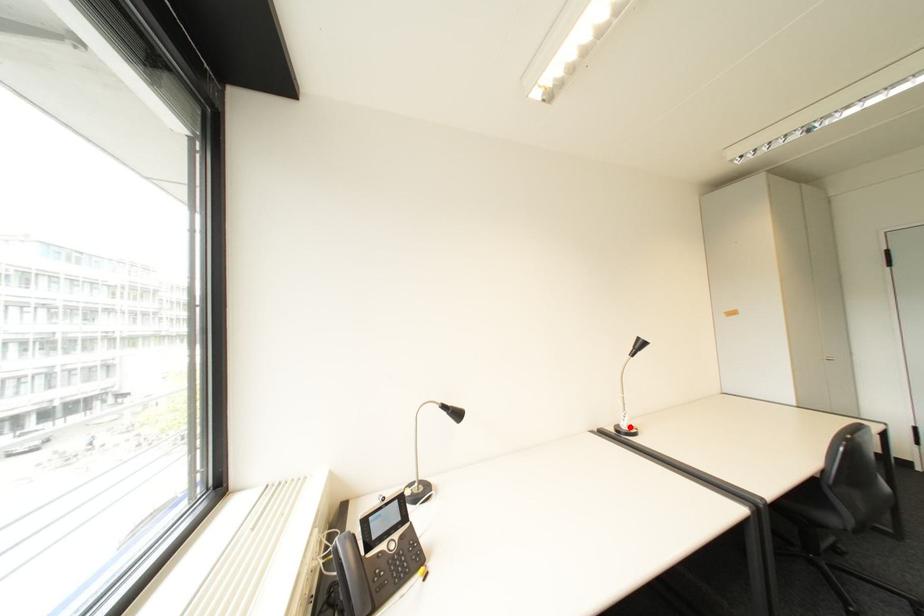
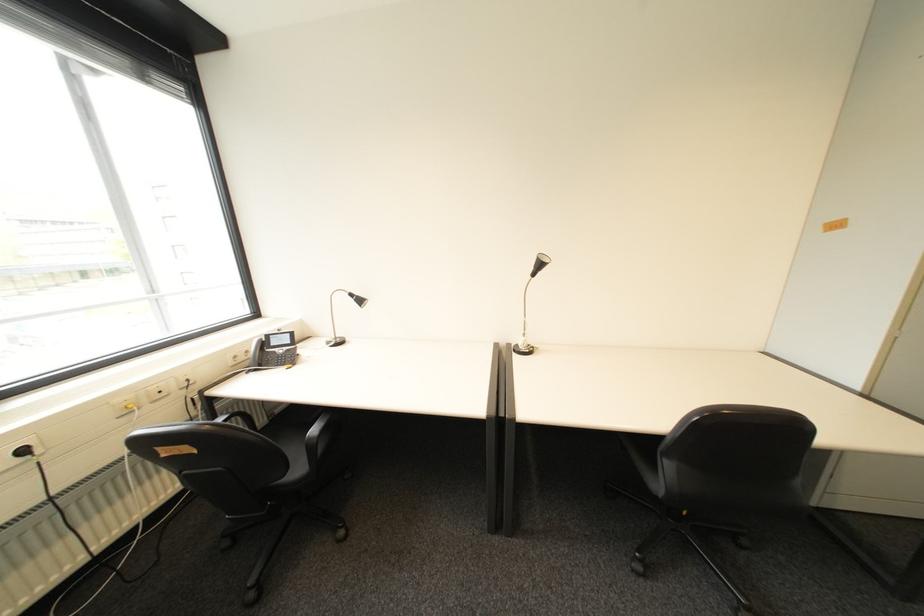
Where in the second image is the point corresponding to the highlighted location from the first image?

(528, 345)